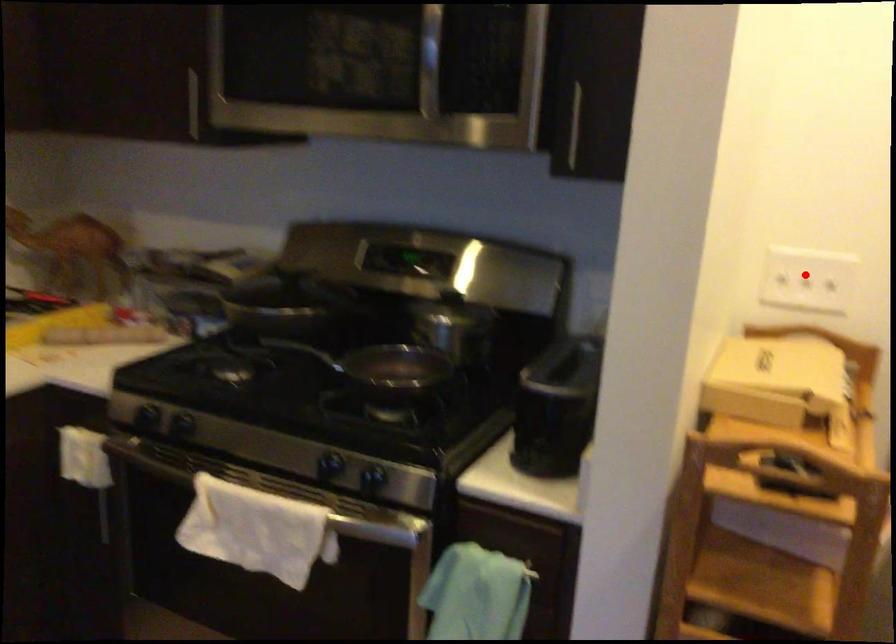
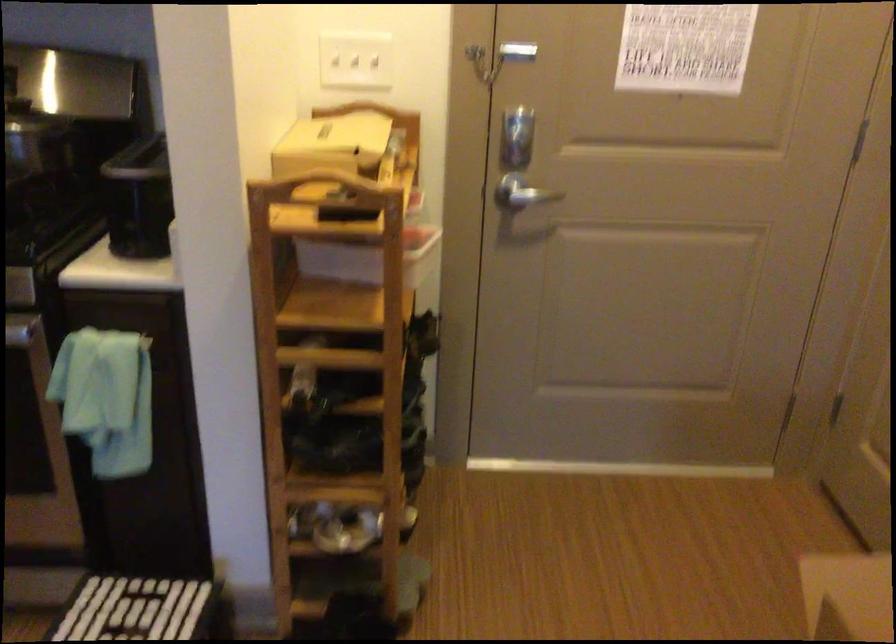
Question: I am providing you with two images of the same scene from different viewpoints. A red point is shown in image1. For the corresponding object point in image2, is it positioned nearer or farther from the camera?

Choices:
 (A) Nearer
 (B) Farther

Answer: (B)